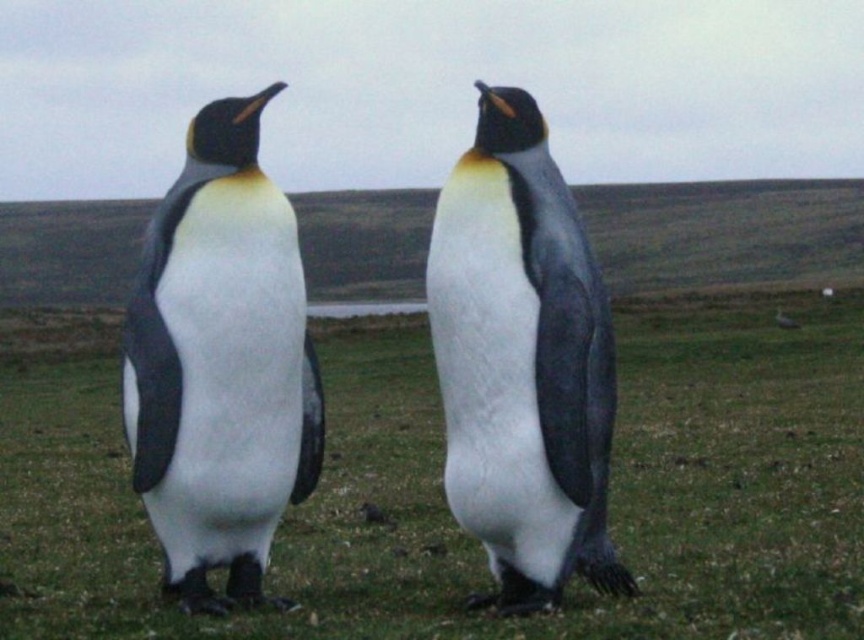
Does point (744, 400) lie in front of point (216, 608)?

No, (744, 400) is further to viewer.

Is green grass at center below white matte penguin at left?

Indeed, green grass at center is positioned under white matte penguin at left.

Which is behind, point (685, 342) or point (272, 260)?

The point (685, 342) is more distant.

Identify the location of green grass at center. This screenshot has height=640, width=864. (442, 492).

The image size is (864, 640). What do you see at coordinates (442, 492) in the screenshot? I see `green grass at center` at bounding box center [442, 492].

What do you see at coordinates (442, 492) in the screenshot? I see `green grass at center` at bounding box center [442, 492].

Locate an element on the screen. The image size is (864, 640). green grass at center is located at coordinates (442, 492).

Is matte black penguin at center to the left of white matte penguin at left from the viewer's perspective?

In fact, matte black penguin at center is to the right of white matte penguin at left.

Can you confirm if matte black penguin at center is taller than white matte penguin at left?

Correct, matte black penguin at center is much taller as white matte penguin at left.

Does point (475, 84) come farther from viewer compared to point (275, 196)?

No.

The height and width of the screenshot is (640, 864). Find the location of `matte black penguin at center`. matte black penguin at center is located at coordinates (522, 362).